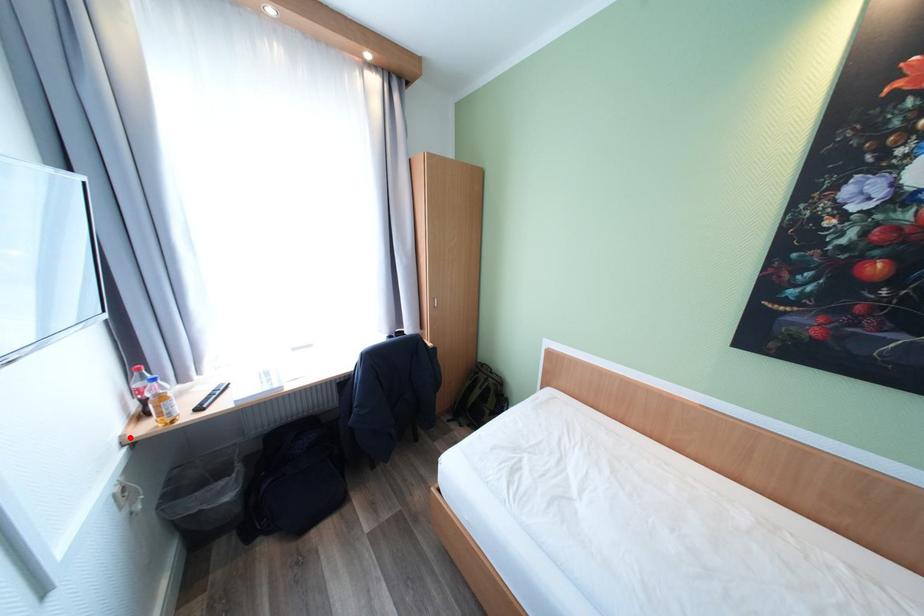
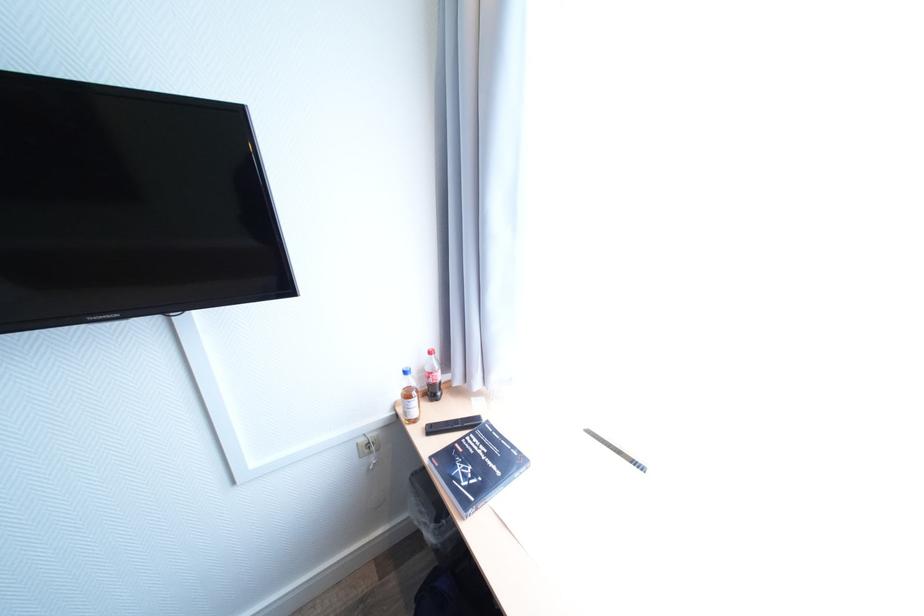
Question: I am providing you with two images of the same scene from different viewpoints. In image1, a red point is highlighted. Considering the same 3D point in image2, which of the following is correct?

Choices:
 (A) It is closer
 (B) It is farther

Answer: (B)